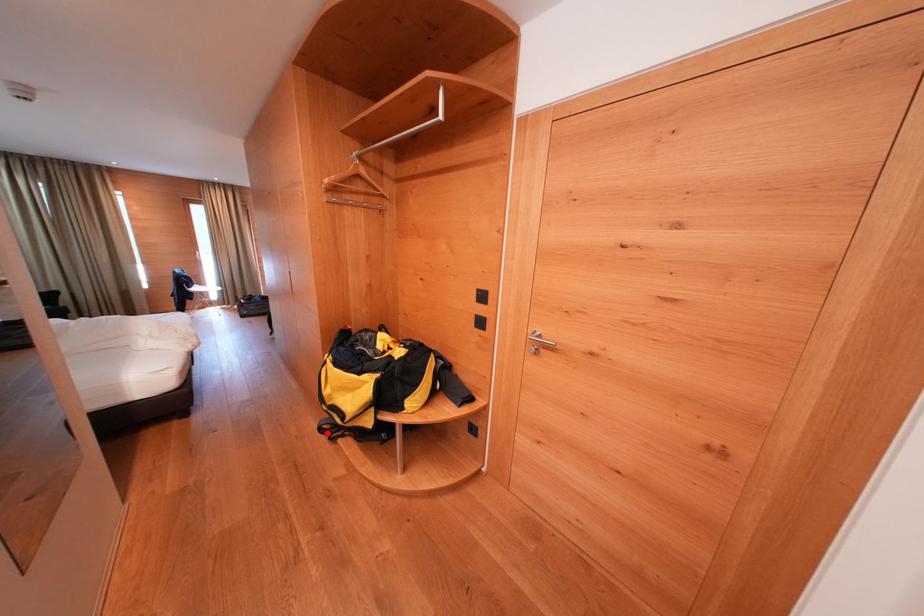
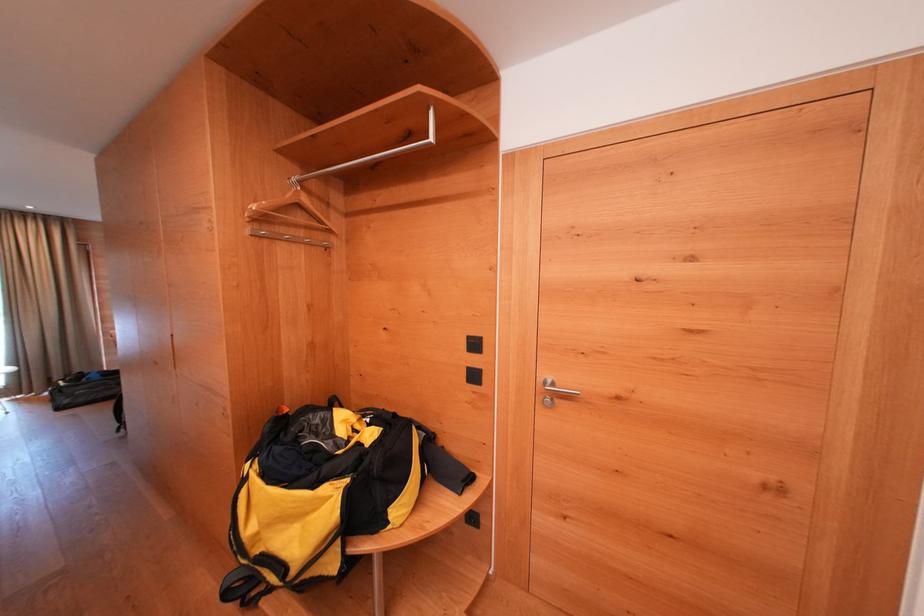
Locate, in the second image, the point that corresponds to the highlighted location in the first image.

(234, 599)